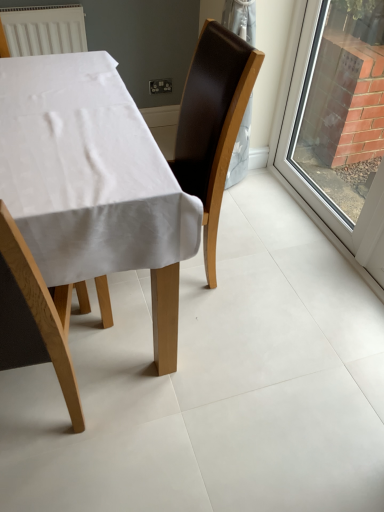
Locate an element on the screen. free space in front of clear glass window at right is located at coordinates (302, 270).